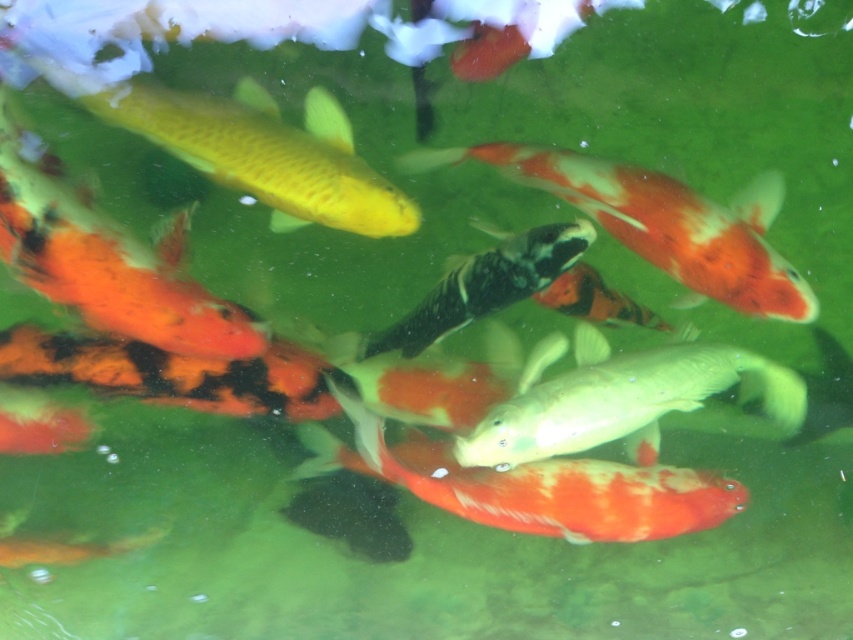
Question: Is shiny gold fish at upper center positioned in front of matte green fish at center?

Choices:
 (A) yes
 (B) no

Answer: (A)

Question: Which object appears closest to the camera in this image?

Choices:
 (A) matte green fish at center
 (B) orange and white speckled goldfish at center
 (C) shiny gold fish at upper center

Answer: (B)

Question: Considering the real-world distances, which object is farthest from the orange and white speckled goldfish at center?

Choices:
 (A) shiny black and white fish at center
 (B) matte green fish at center

Answer: (B)

Question: Which of the following is the closest to the observer?

Choices:
 (A) shiny black and white fish at center
 (B) orange and white speckled goldfish at center
 (C) matte green fish at center

Answer: (B)

Question: Can you confirm if orange and white speckled goldfish at center is wider than matte green fish at center?

Choices:
 (A) no
 (B) yes

Answer: (B)

Question: Does shiny gold fish at upper center lie behind shiny black and white fish at center?

Choices:
 (A) no
 (B) yes

Answer: (A)